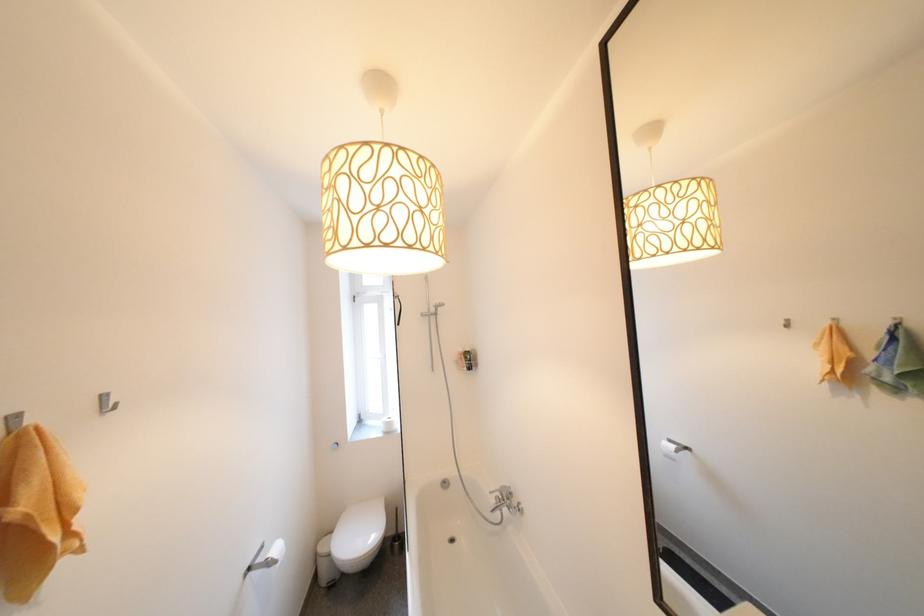
Find the location of a particular element. toilet brush handle is located at coordinates (396, 537).